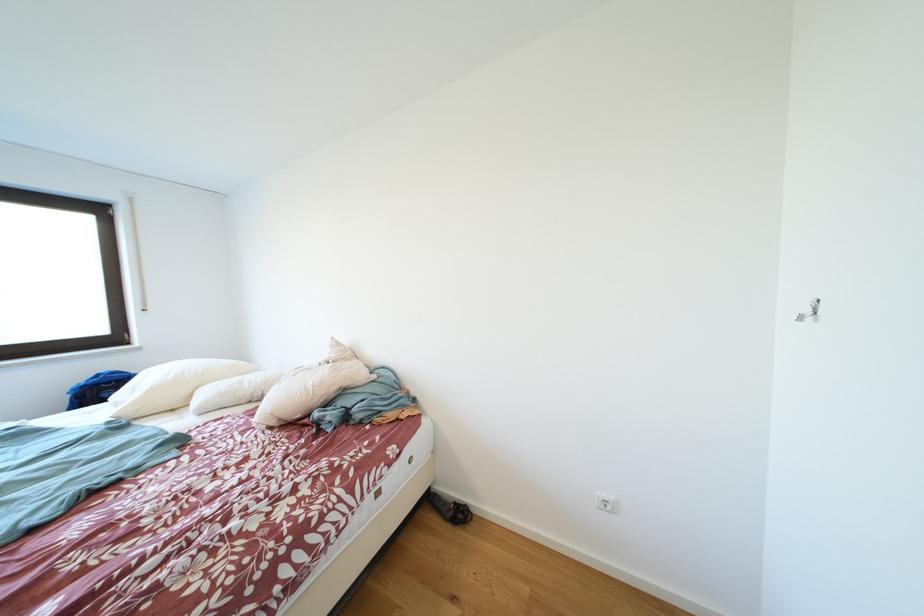
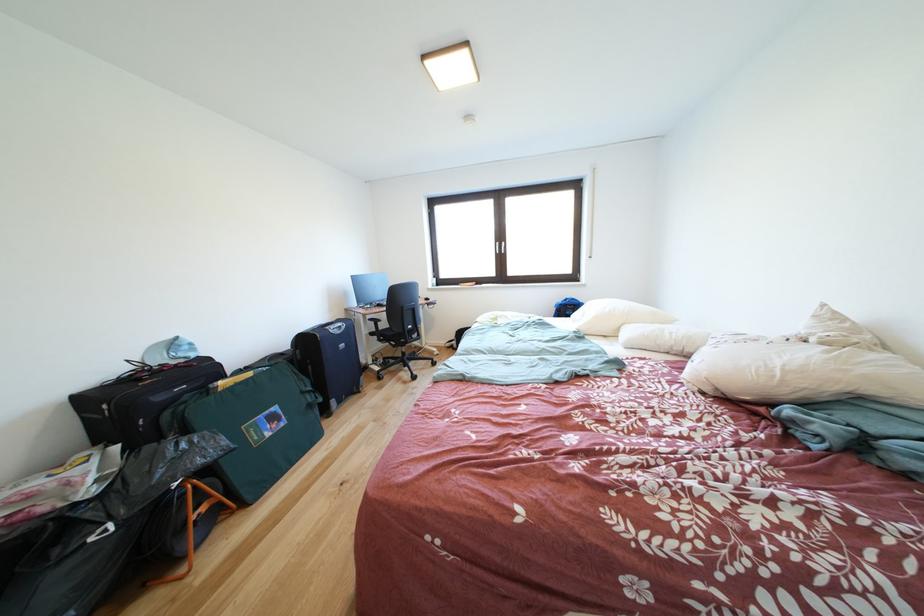
Question: I am providing you with two images of the same scene from different viewpoints. Which of the following objects are not visible in image2?

Choices:
 (A) suitcase handle
 (B) white pillow
 (C) black suitcase handle
 (D) none of these

Answer: (D)